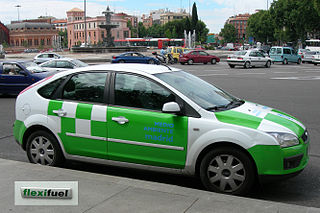
At what (x,y) coordinates should I click in order to perform the action: click on door handle. Please return your answer as a coordinate pair (x, y). This screenshot has height=213, width=320. Looking at the image, I should click on (119, 118), (56, 111).